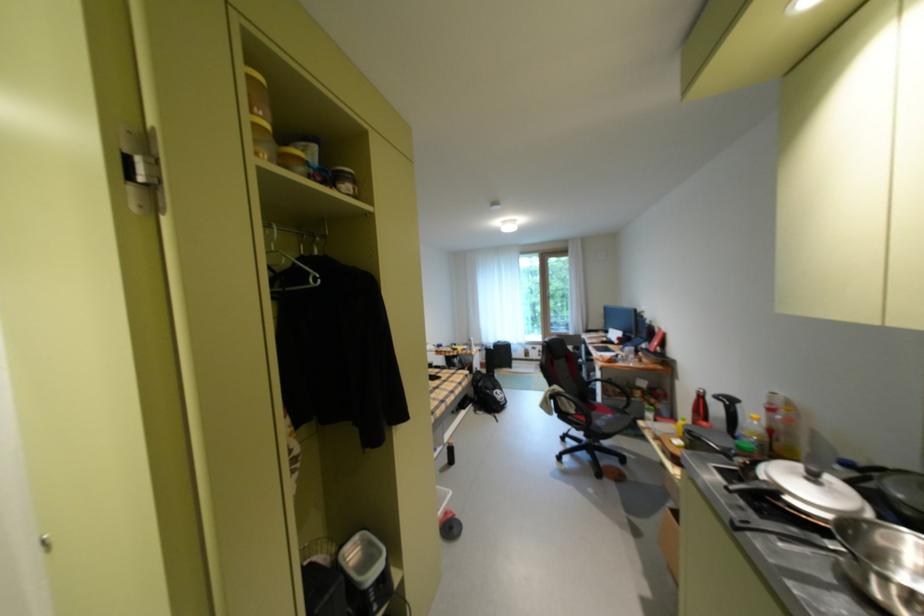
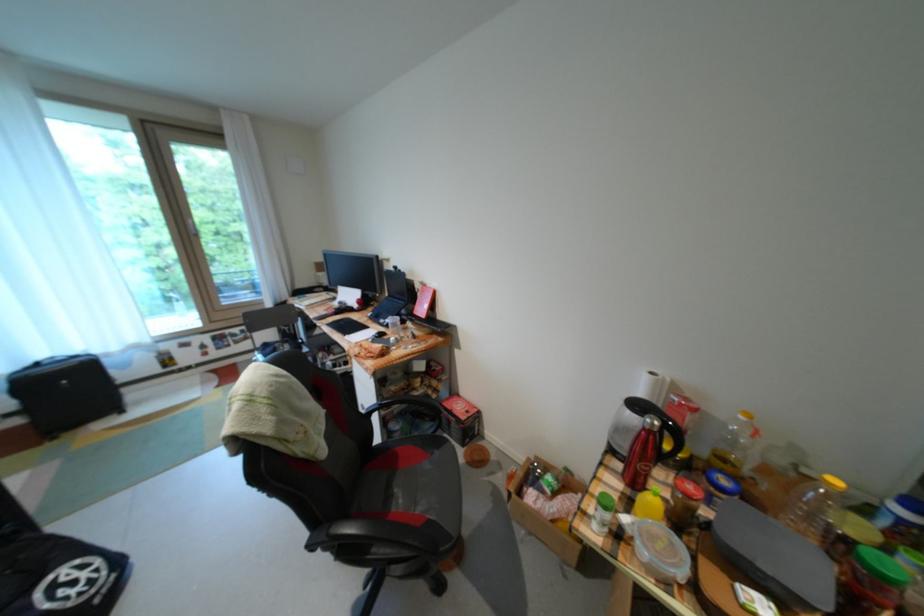
Locate, in the second image, the point that corresponds to (x=784, y=395) in the first image.

(662, 374)